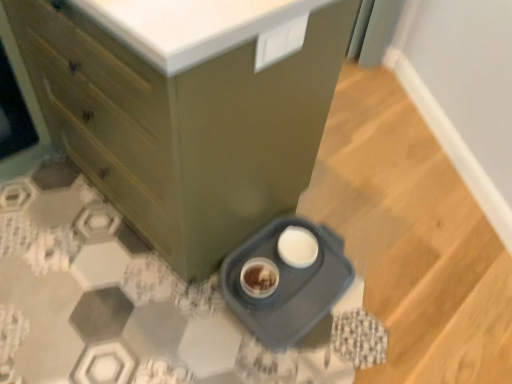
Where is `free space to the left of gray plastic tray at lower center`? free space to the left of gray plastic tray at lower center is located at coordinates (157, 310).